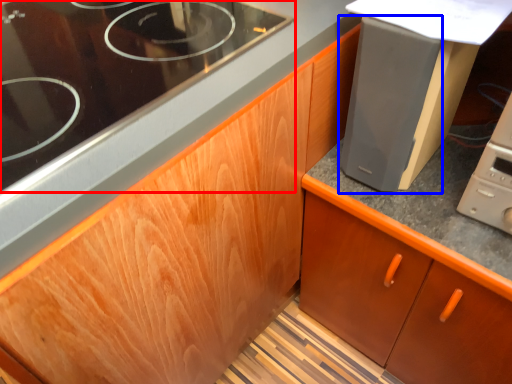
Question: Which object is closer to the camera taking this photo, gas stove (highlighted by a red box) or appliance (highlighted by a blue box)?

Choices:
 (A) gas stove
 (B) appliance

Answer: (A)